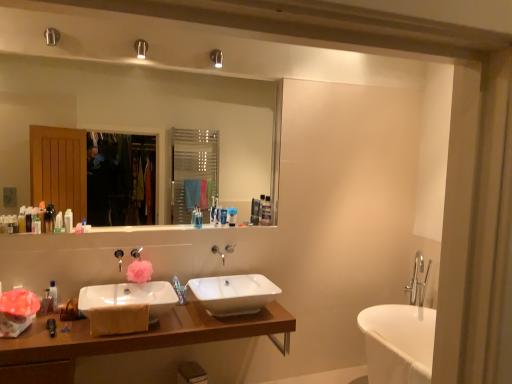
Question: From the image's perspective, relative to clear plastic bottle at upper center, which appears as the 11th toiletry when viewed from the left, is translucent plastic bottle at lower left, the sixth toiletry from the left, above or below?

Choices:
 (A) below
 (B) above

Answer: (A)

Question: Considering the relative positions of translucent plastic bottle at lower left, the sixth toiletry from the left, and clear plastic bottle at upper center, which appears as the 11th toiletry when viewed from the left, in the image provided, is translucent plastic bottle at lower left, the sixth toiletry from the left, to the left or to the right of clear plastic bottle at upper center, which appears as the 11th toiletry when viewed from the left,?

Choices:
 (A) left
 (B) right

Answer: (A)

Question: Estimate the real-world distances between objects in this image. Which object is farther from the blue matte toothpaste tube at center, placed as the 4th toiletry when sorted from right to left?

Choices:
 (A) wooden cabinet at lower left
 (B) satin silver toothbrush at center, the 10th toiletry from the left
 (C) white glossy mirror at upper center
 (D) clear plastic bottle at upper center, which ranks as the second toiletry in right-to-left order
 (E) white glossy bottle at left, which is the sixth toiletry in right-to-left order

Answer: (E)

Question: Based on their relative distances, which object is nearer to the translucent plastic bottle at left, which is counted as the fifth toiletry, starting from the left?

Choices:
 (A) translucent plastic bottles at left, which is the 9th toiletry in right-to-left order
 (B) translucent plastic bottle at left, which is the 10th toiletry from right to left
 (C) silver metallic tap at center
 (D) clear plastic bottle at upper center, which ranks as the second toiletry in right-to-left order
 (E) translucent plastic toothbrushes at center, acting as the 8th toiletry starting from the left

Answer: (A)